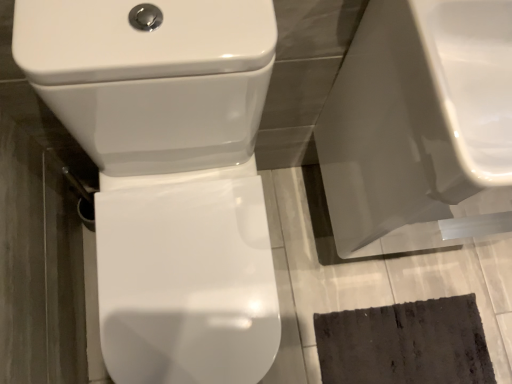
Where is `glossy ceramic sink at upper right`? This screenshot has height=384, width=512. glossy ceramic sink at upper right is located at coordinates (418, 124).

Is white glossy toilet at center next to white glossy toilet seat at center?

No, white glossy toilet at center is not beside white glossy toilet seat at center.

Is point (94, 59) positioned after point (493, 354)?

No.

Considering the sizes of white glossy toilet at center and white glossy toilet seat at center in the image, is white glossy toilet at center wider or thinner than white glossy toilet seat at center?

white glossy toilet at center is thinner than white glossy toilet seat at center.

Is white glossy toilet at center taller than white glossy toilet seat at center?

Indeed, white glossy toilet at center has a greater height compared to white glossy toilet seat at center.

Could you tell me if white glossy toilet seat at center is facing glossy ceramic sink at upper right?

No, white glossy toilet seat at center is not turned towards glossy ceramic sink at upper right.

From the image's perspective, is white glossy toilet seat at center positioned above or below glossy ceramic sink at upper right?

Based on their image positions, white glossy toilet seat at center is located beneath glossy ceramic sink at upper right.

From a real-world perspective, which object stands above the other?

From a 3D spatial view, glossy ceramic sink at upper right is above.

Who is more distant, white glossy toilet seat at center or glossy ceramic sink at upper right?

white glossy toilet seat at center is more distant.

Does white glossy toilet seat at center have a smaller size compared to white glossy toilet at center?

Correct, white glossy toilet seat at center occupies less space than white glossy toilet at center.

Is white glossy toilet seat at center to the right of white glossy toilet at center from the viewer's perspective?

Indeed, white glossy toilet seat at center is positioned on the right side of white glossy toilet at center.

Is white glossy toilet seat at center looking in the opposite direction of white glossy toilet at center?

No.

Which is behind, point (383, 151) or point (167, 311)?

The point (167, 311) is farther from the camera.

From the image's perspective, is glossy ceramic sink at upper right positioned above or below white glossy toilet at center?

Clearly, from the image's perspective, glossy ceramic sink at upper right is above white glossy toilet at center.

Is there a large distance between glossy ceramic sink at upper right and white glossy toilet at center?

Actually, glossy ceramic sink at upper right and white glossy toilet at center are a little close together.

Is glossy ceramic sink at upper right bigger or smaller than white glossy toilet at center?

glossy ceramic sink at upper right is smaller than white glossy toilet at center.

From a real-world perspective, which object stands above the other?

From a 3D spatial view, glossy ceramic sink at upper right is above.

The height and width of the screenshot is (384, 512). I want to click on concrete below the glossy ceramic sink at upper right (from the image's perspective), so click(382, 269).

From the picture: Between glossy ceramic sink at upper right and white glossy toilet seat at center, which one has more height?

With more height is glossy ceramic sink at upper right.

Which is correct: glossy ceramic sink at upper right is inside white glossy toilet seat at center, or outside of it?

glossy ceramic sink at upper right is not enclosed by white glossy toilet seat at center.

Is white glossy toilet at center positioned far away from glossy ceramic sink at upper right?

Actually, white glossy toilet at center and glossy ceramic sink at upper right are a little close together.

Locate an element on the screen. The height and width of the screenshot is (384, 512). toilet on the left of glossy ceramic sink at upper right is located at coordinates (168, 175).

Which is correct: white glossy toilet at center is inside glossy ceramic sink at upper right, or outside of it?

white glossy toilet at center is outside glossy ceramic sink at upper right.

Which object is closer to the camera, white glossy toilet at center or glossy ceramic sink at upper right?

white glossy toilet at center is in front.

I want to click on toilet in front of the white glossy toilet seat at center, so click(168, 175).

Locate an element on the screen. This screenshot has width=512, height=384. porcelain lying on the right of white glossy toilet seat at center is located at coordinates (418, 124).

Estimate the real-world distances between objects in this image. Which object is further from white glossy toilet seat at center, white glossy toilet at center or glossy ceramic sink at upper right?

The object further to white glossy toilet seat at center is white glossy toilet at center.

Which object lies further to the anchor point white glossy toilet at center, glossy ceramic sink at upper right or white glossy toilet seat at center?

white glossy toilet seat at center is further to white glossy toilet at center.

Looking at the image, which one is located closer to glossy ceramic sink at upper right, white glossy toilet seat at center or white glossy toilet at center?

white glossy toilet at center is closer to glossy ceramic sink at upper right.

When comparing their distances from white glossy toilet at center, does white glossy toilet seat at center or glossy ceramic sink at upper right seem closer?

glossy ceramic sink at upper right is closer to white glossy toilet at center.

Which object lies further to the anchor point glossy ceramic sink at upper right, white glossy toilet at center or white glossy toilet seat at center?

white glossy toilet seat at center is further to glossy ceramic sink at upper right.

Based on their spatial positions, is glossy ceramic sink at upper right or white glossy toilet at center further from white glossy toilet seat at center?

The object further to white glossy toilet seat at center is white glossy toilet at center.

This screenshot has width=512, height=384. I want to click on porcelain located between white glossy toilet at center and white glossy toilet seat at center in the depth direction, so click(x=418, y=124).